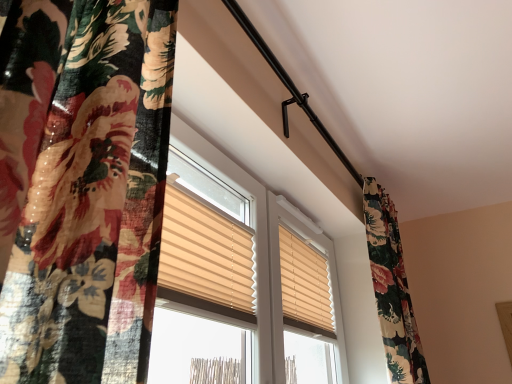
Question: Is floral fabric curtain at left beside beige fabric window blind at center?

Choices:
 (A) yes
 (B) no

Answer: (B)

Question: Considering the relative sizes of floral fabric curtain at left and beige fabric window blind at center in the image provided, is floral fabric curtain at left taller than beige fabric window blind at center?

Choices:
 (A) yes
 (B) no

Answer: (A)

Question: Can you confirm if floral fabric curtain at left is smaller than beige fabric window blind at center?

Choices:
 (A) no
 (B) yes

Answer: (A)

Question: Is beige fabric window blind at center at the back of floral fabric curtain at left?

Choices:
 (A) no
 (B) yes

Answer: (B)

Question: Does floral fabric curtain at left have a lesser height compared to beige fabric window blind at center?

Choices:
 (A) yes
 (B) no

Answer: (B)

Question: Is floral fabric curtain at left completely or partially outside of beige fabric window blind at center?

Choices:
 (A) yes
 (B) no

Answer: (A)

Question: From the image's perspective, does beige fabric window blind at center appear higher than floral fabric curtain at left?

Choices:
 (A) yes
 (B) no

Answer: (B)

Question: Are beige fabric window blind at center and floral fabric curtain at left making contact?

Choices:
 (A) yes
 (B) no

Answer: (B)

Question: Is beige fabric window blind at center further to the viewer compared to floral fabric curtain at left?

Choices:
 (A) yes
 (B) no

Answer: (A)

Question: Considering the relative positions of beige fabric window blind at center and floral fabric curtain at left in the image provided, is beige fabric window blind at center to the right of floral fabric curtain at left from the viewer's perspective?

Choices:
 (A) no
 (B) yes

Answer: (B)

Question: Can you confirm if beige fabric window blind at center is wider than floral fabric curtain at left?

Choices:
 (A) no
 (B) yes

Answer: (A)

Question: Can you confirm if beige fabric window blind at center is shorter than floral fabric curtain at left?

Choices:
 (A) no
 (B) yes

Answer: (B)

Question: Based on their positions, is floral fabric curtain at left located to the left or right of beige fabric window blind at center?

Choices:
 (A) right
 (B) left

Answer: (B)